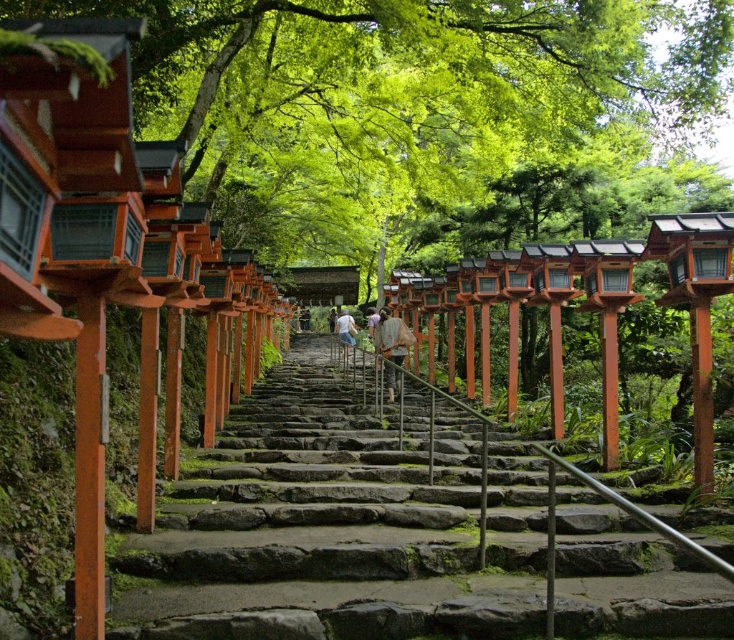
Question: Observing the image, what is the correct spatial positioning of smooth stone stairs at center in reference to matte orange torii gate at center?

Choices:
 (A) right
 (B) left

Answer: (B)

Question: Among these objects, which one is nearest to the camera?

Choices:
 (A) light brown wooden post at center
 (B) dark brown leather jacket at center
 (C) smooth stone stairs at center
 (D) matte orange torii gate at center

Answer: (C)

Question: Is green leafy tree at upper center above matte orange torii gate at center?

Choices:
 (A) yes
 (B) no

Answer: (A)

Question: Considering the real-world distances, which object is farthest from the light brown wooden post at center?

Choices:
 (A) light brown leather backpack at center
 (B) matte orange torii gate at center
 (C) smooth stone stairs at center
 (D) green leafy tree at upper center

Answer: (C)

Question: Does green leafy tree at upper center come behind light brown leather backpack at center?

Choices:
 (A) no
 (B) yes

Answer: (A)

Question: Which point is farther to the camera?

Choices:
 (A) matte orange torii gate at center
 (B) dark brown leather jacket at center
 (C) smooth stone stairs at center

Answer: (B)